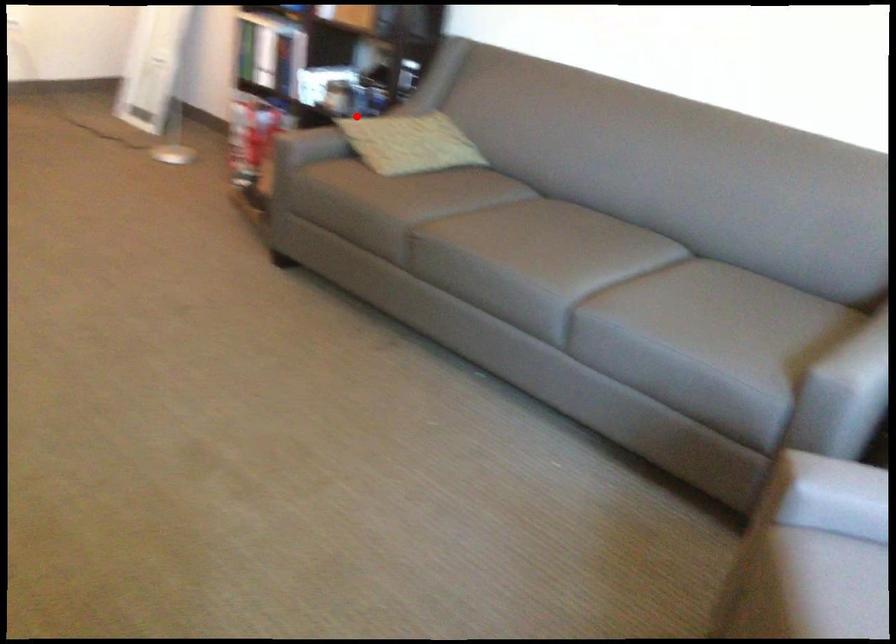
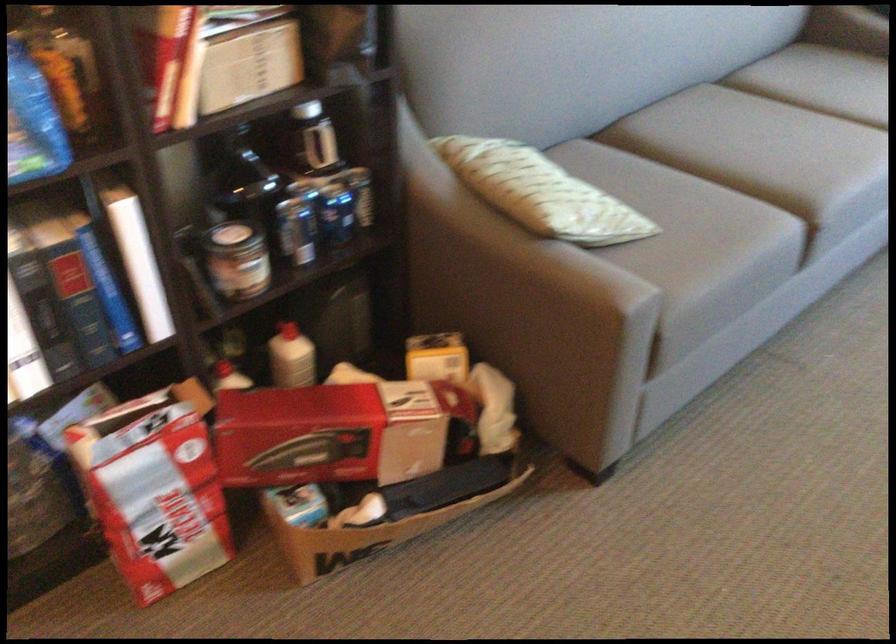
Question: I am providing you with two images of the same scene from different viewpoints. In image1, a red point is highlighted. Considering the same 3D point in image2, which of the following is correct?

Choices:
 (A) It is closer
 (B) It is farther

Answer: (A)